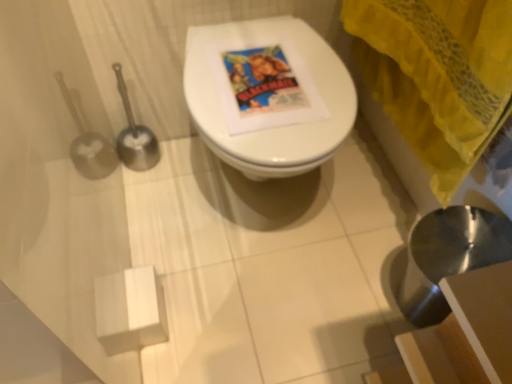
Image resolution: width=512 pixels, height=384 pixels. I want to click on free space above white glossy toilet at center (from a real-world perspective), so click(251, 82).